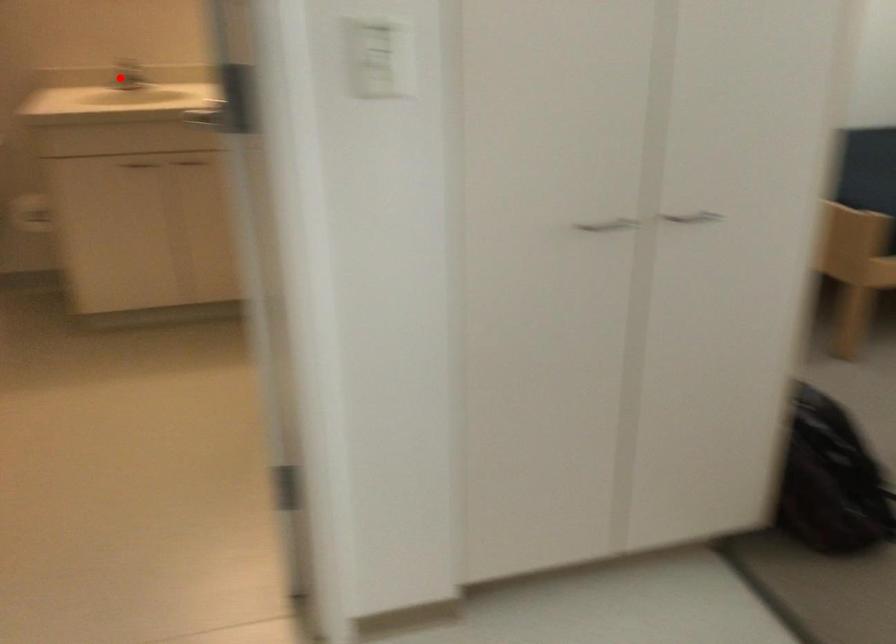
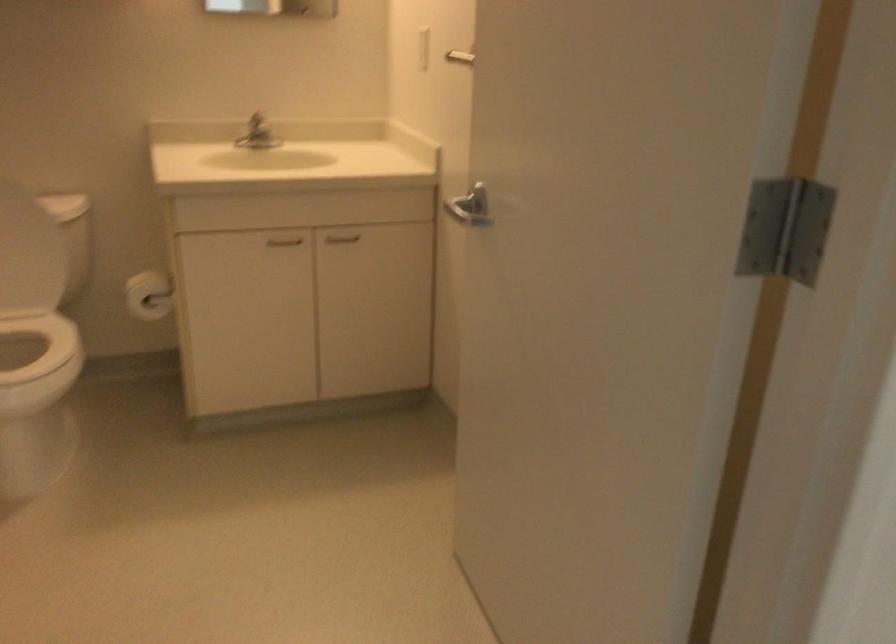
Question: I am providing you with two images of the same scene from different viewpoints. A red point is shown in image1. For the corresponding object point in image2, is it positioned nearer or farther from the camera?

Choices:
 (A) Nearer
 (B) Farther

Answer: (A)